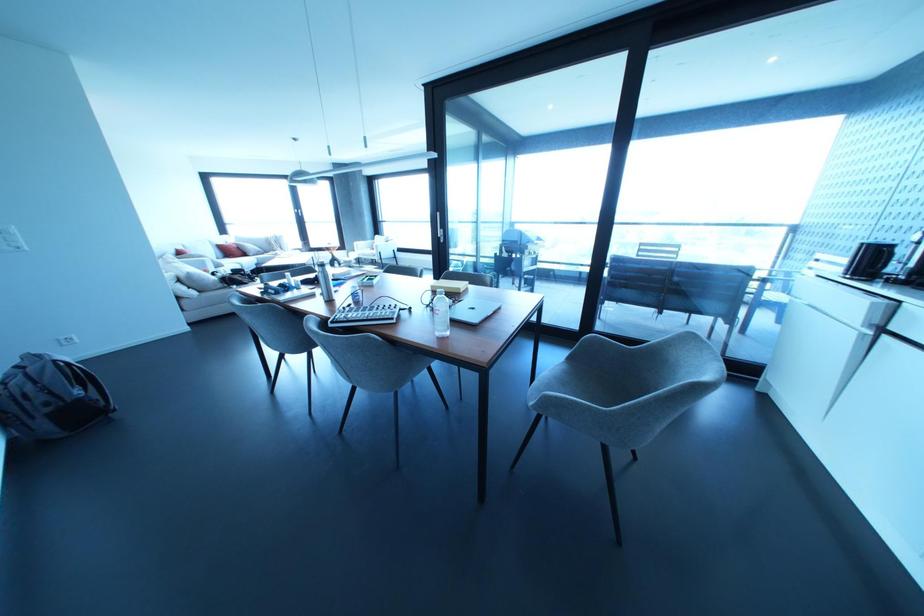
Locate an element on the screen. The width and height of the screenshot is (924, 616). plastic water bottle is located at coordinates (441, 314).